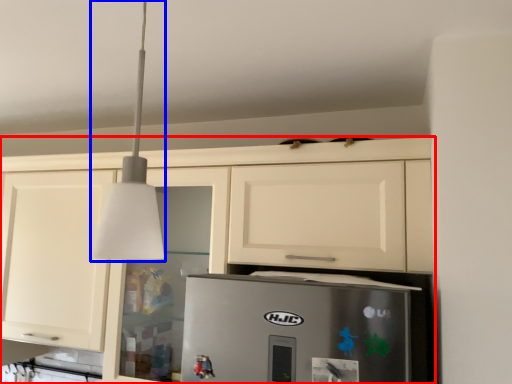
Question: Which point is closer to the camera, cabinetry (highlighted by a red box) or light fixture (highlighted by a blue box)?

Choices:
 (A) cabinetry
 (B) light fixture

Answer: (B)